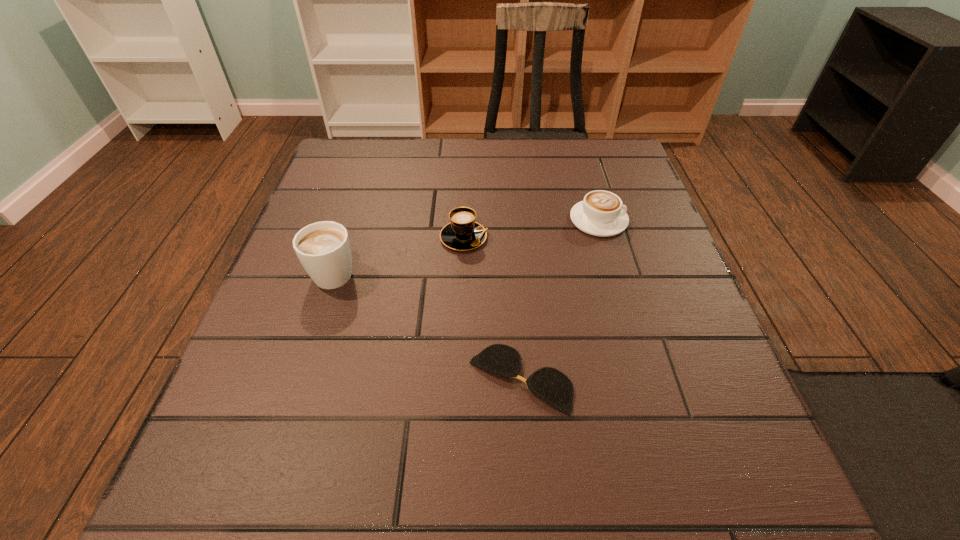
Where is `blank area in the image that satisfies the following two spatial constraints: 1. with the handle on the side of the second cappuccino from left to right; 2. on the right side of the leftmost cappuccino`? blank area in the image that satisfies the following two spatial constraints: 1. with the handle on the side of the second cappuccino from left to right; 2. on the right side of the leftmost cappuccino is located at coordinates (346, 238).

You are a GUI agent. You are given a task and a screenshot of the screen. Output one action in this format:
    pyautogui.click(x=<x>, y=<y>)
    Task: Click on the vacant space that satisfies the following two spatial constraints: 1. with the handle on the side of the tallest cappuccino; 2. on the left side of the second cappuccino from left to right
    The width and height of the screenshot is (960, 540).
    Given the screenshot: What is the action you would take?
    point(346,238)